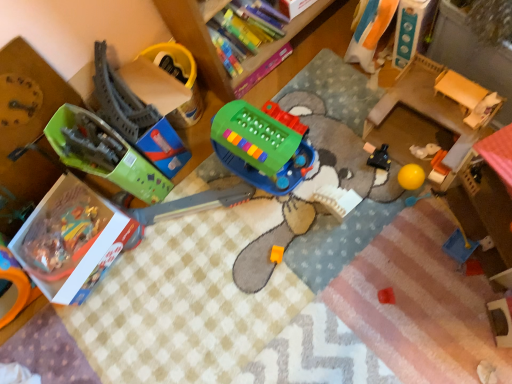
Locate an element on the screen. The image size is (512, 384). vacant area that lies between wooden bookshelf at upper center and orange fabric doll at upper right, arranged as the third toy when viewed from the right is located at coordinates (322, 86).